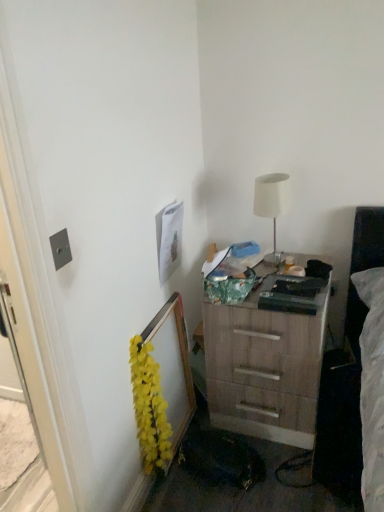
Question: Is metallic silver outlet at left bigger than white matte table lamp at upper right?

Choices:
 (A) yes
 (B) no

Answer: (B)

Question: Does metallic silver outlet at left appear on the right side of white matte table lamp at upper right?

Choices:
 (A) yes
 (B) no

Answer: (B)

Question: Is metallic silver outlet at left further to the viewer compared to white matte table lamp at upper right?

Choices:
 (A) yes
 (B) no

Answer: (B)

Question: Would you say metallic silver outlet at left contains white matte table lamp at upper right?

Choices:
 (A) yes
 (B) no

Answer: (B)

Question: Considering the relative sizes of metallic silver outlet at left and white matte table lamp at upper right in the image provided, is metallic silver outlet at left taller than white matte table lamp at upper right?

Choices:
 (A) no
 (B) yes

Answer: (A)

Question: From the image's perspective, is wooden chest of drawers at lower right above or below white matte table lamp at upper right?

Choices:
 (A) below
 (B) above

Answer: (A)

Question: Relative to white matte table lamp at upper right, is wooden chest of drawers at lower right in front or behind?

Choices:
 (A) front
 (B) behind

Answer: (A)

Question: From a real-world perspective, relative to white matte table lamp at upper right, is wooden chest of drawers at lower right vertically above or below?

Choices:
 (A) below
 (B) above

Answer: (A)

Question: Choose the correct answer: Is wooden chest of drawers at lower right inside white matte table lamp at upper right or outside it?

Choices:
 (A) inside
 (B) outside

Answer: (B)

Question: From a real-world perspective, is white matte table lamp at upper right positioned above or below metallic silver outlet at left?

Choices:
 (A) above
 (B) below

Answer: (B)

Question: Which is correct: white matte table lamp at upper right is inside metallic silver outlet at left, or outside of it?

Choices:
 (A) inside
 (B) outside

Answer: (B)

Question: Relative to metallic silver outlet at left, is white matte table lamp at upper right in front or behind?

Choices:
 (A) behind
 (B) front

Answer: (A)

Question: In terms of size, does white matte table lamp at upper right appear bigger or smaller than metallic silver outlet at left?

Choices:
 (A) big
 (B) small

Answer: (A)

Question: Is point (246, 424) positioned closer to the camera than point (165, 435)?

Choices:
 (A) farther
 (B) closer

Answer: (A)

Question: Relative to yellow artificial flowers at left, is wooden chest of drawers at lower right in front or behind?

Choices:
 (A) behind
 (B) front

Answer: (A)